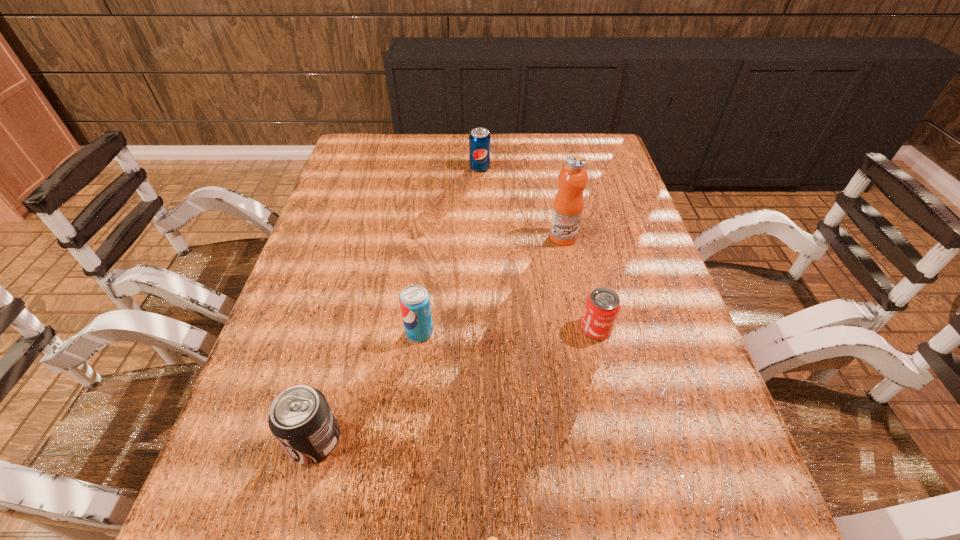
Identify the location of vacant region located on the right of the rightmost soda can. Image resolution: width=960 pixels, height=540 pixels. (537, 168).

At what (x,y) coordinates should I click in order to perform the action: click on vacant space located on the right of the nearest soda can. Please return your answer as a coordinate pair (x, y). The image size is (960, 540). Looking at the image, I should click on (441, 441).

This screenshot has width=960, height=540. I want to click on vacant area situated 0.230m on the right of the second farthest soda can, so click(x=539, y=332).

Where is `vacant point located on the back of the can`? vacant point located on the back of the can is located at coordinates (585, 278).

Find the location of a particular element. object located at the far edge is located at coordinates (479, 140).

Locate an element on the screen. The height and width of the screenshot is (540, 960). object present at the left edge is located at coordinates (300, 418).

The height and width of the screenshot is (540, 960). Find the location of `object located in the right edge section of the desktop`. object located in the right edge section of the desktop is located at coordinates [602, 307].

In order to click on free location at the far edge in this screenshot , I will do `click(550, 166)`.

In the image, there is a desktop. Identify the location of vacant space at the left edge. (331, 344).

At what (x,y) coordinates should I click in order to perform the action: click on free space at the right edge. Please return your answer as a coordinate pair (x, y). Image resolution: width=960 pixels, height=540 pixels. Looking at the image, I should click on pyautogui.click(x=611, y=219).